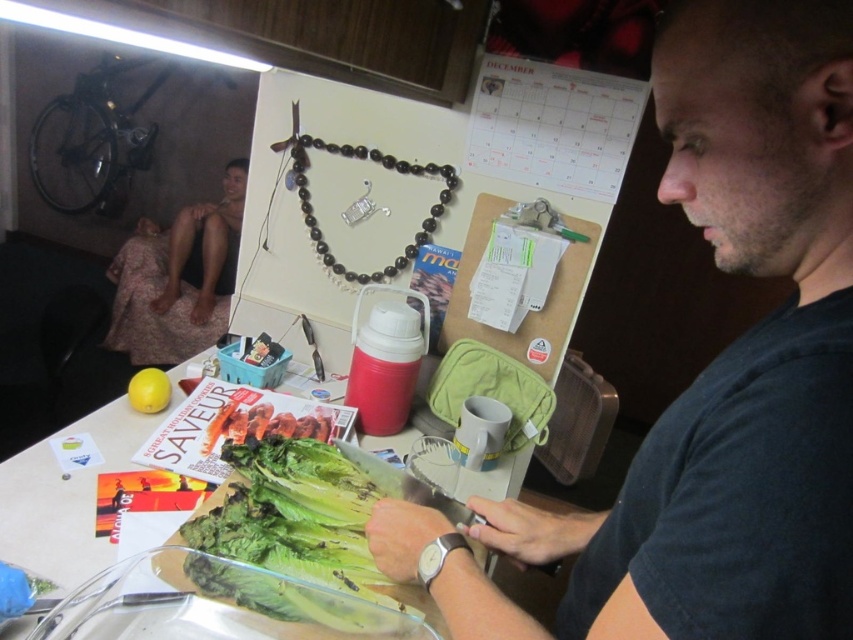
Is green leafy lettuce at center smaller than smooth skin man at upper left?

Yes, green leafy lettuce at center is smaller than smooth skin man at upper left.

In the scene shown: Does green leafy lettuce at center appear on the right side of smooth skin man at upper left?

Yes, green leafy lettuce at center is to the right of smooth skin man at upper left.

You are a GUI agent. You are given a task and a screenshot of the screen. Output one action in this format:
    pyautogui.click(x=<x>, y=<y>)
    Task: Click on the green leafy lettuce at center
    
    Given the screenshot: What is the action you would take?
    pyautogui.click(x=65, y=497)

Can you confirm if dark gray shirt at center is positioned to the left of green leafy lettuce at center?

In fact, dark gray shirt at center is to the right of green leafy lettuce at center.

Is point (724, 26) positioned before point (103, 452)?

That is True.

Locate an element on the screen. This screenshot has width=853, height=640. dark gray shirt at center is located at coordinates (711, 372).

How far apart are dark gray shirt at center and green leafy vegetable at lower center?

dark gray shirt at center is 12.04 inches from green leafy vegetable at lower center.

Is point (830, 300) behind point (335, 564)?

No, (830, 300) is in front of (335, 564).

Image resolution: width=853 pixels, height=640 pixels. What are the coordinates of `dark gray shirt at center` in the screenshot? It's located at (711, 372).